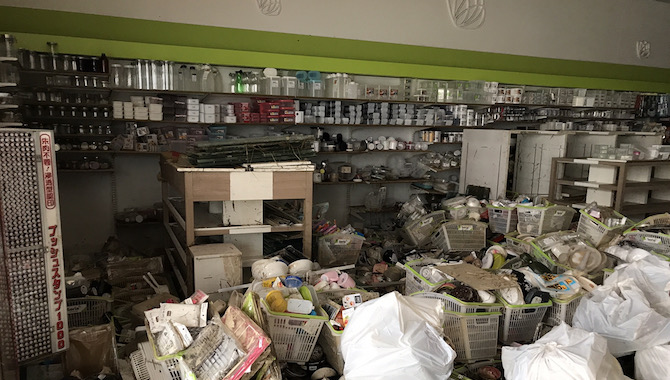
Identify the location of shelf. (159, 88), (171, 119), (88, 147), (86, 165), (400, 177), (392, 209), (383, 144), (388, 124), (393, 97).